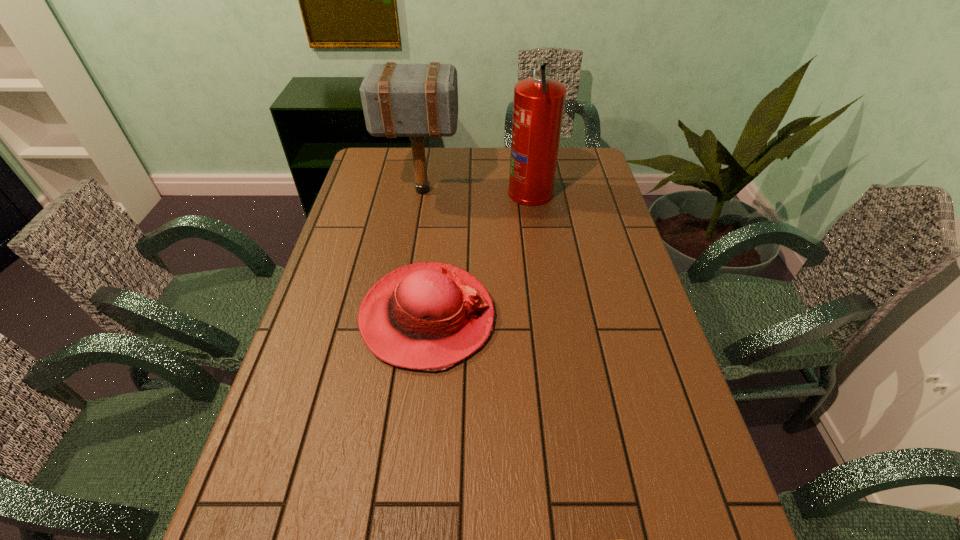
Identify the location of fire extinguisher. (538, 106).

Where is `mallet`? Image resolution: width=960 pixels, height=540 pixels. mallet is located at coordinates (399, 100).

The image size is (960, 540). What are the coordinates of `hat` in the screenshot? It's located at (429, 316).

Locate an element on the screen. the third farthest object is located at coordinates pyautogui.click(x=429, y=316).

The image size is (960, 540). Find the location of `blank space located 0.080m on the instruction side of the fire extinguisher`. blank space located 0.080m on the instruction side of the fire extinguisher is located at coordinates (486, 191).

This screenshot has width=960, height=540. Find the location of `free space located 0.240m on the instruction side of the fire extinguisher`. free space located 0.240m on the instruction side of the fire extinguisher is located at coordinates pos(441,191).

This screenshot has width=960, height=540. What are the coordinates of `free space located on the instruction side of the fire extinguisher` in the screenshot? It's located at pyautogui.click(x=435, y=191).

Locate an element on the screen. blank area located 0.250m on the striking surface of the mallet is located at coordinates (530, 191).

The width and height of the screenshot is (960, 540). I want to click on vacant space located at the front of the third farthest object with a bow, so click(x=631, y=317).

This screenshot has width=960, height=540. I want to click on fire extinguisher located in the far edge section of the desktop, so click(x=538, y=106).